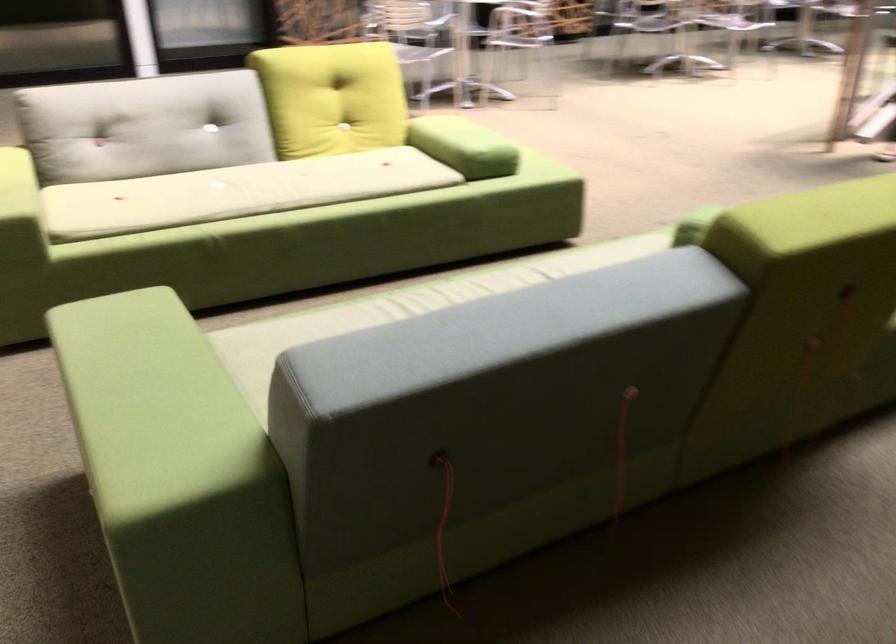
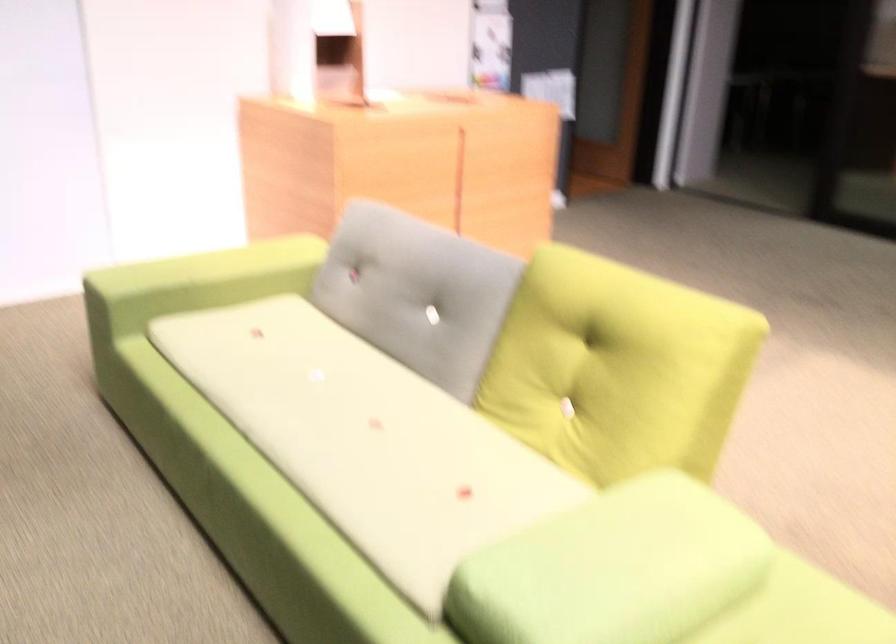
The point at (187, 116) is marked in the first image. Where is the corresponding point in the second image?

(417, 292)